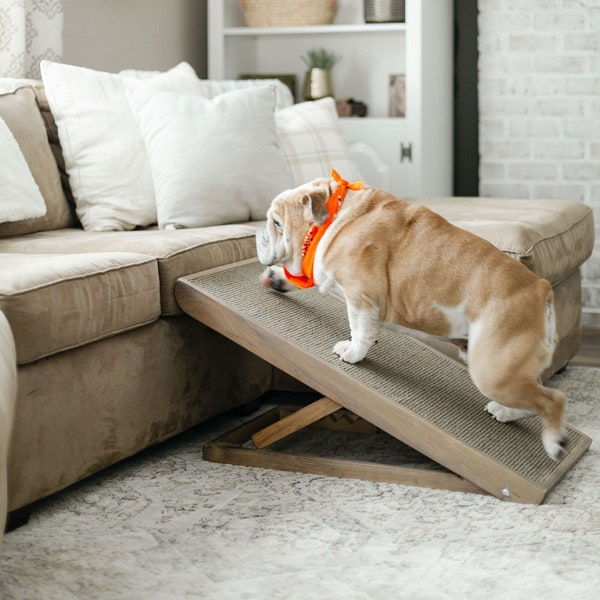
What are the coordinates of `hinge` in the screenshot? It's located at (408, 152).